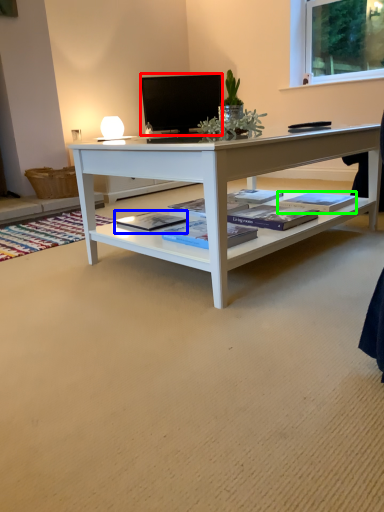
Question: Estimate the real-world distances between objects in this image. Which object is farther from television (highlighted by a red box), book (highlighted by a blue box) or book (highlighted by a green box)?

Choices:
 (A) book
 (B) book

Answer: (A)